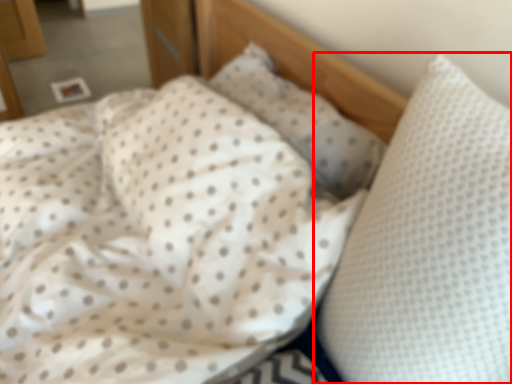
Question: In this image, where is pillow (annotated by the red box) located relative to pillow?

Choices:
 (A) left
 (B) right

Answer: (B)